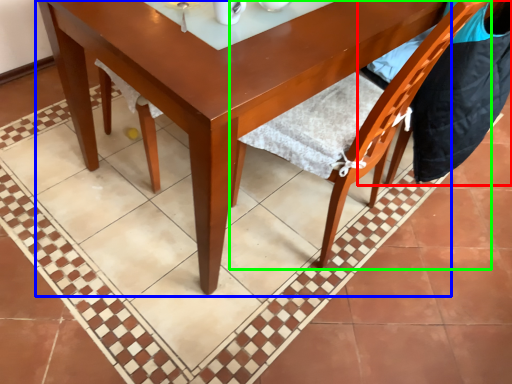
Question: Considering the real-world distances, which object is closest to chair (highlighted by a red box)? round table (highlighted by a blue box) or chair (highlighted by a green box).

Choices:
 (A) round table
 (B) chair

Answer: (B)